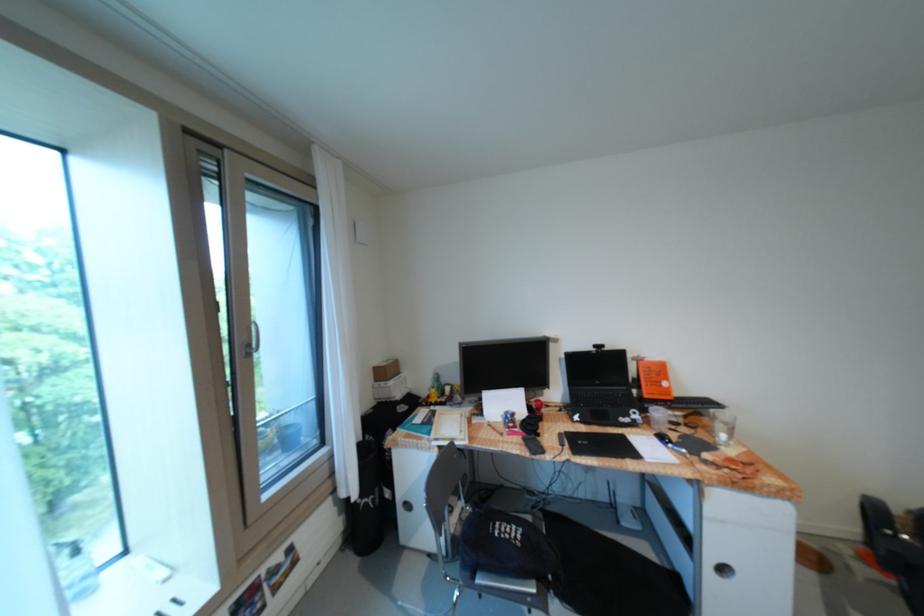
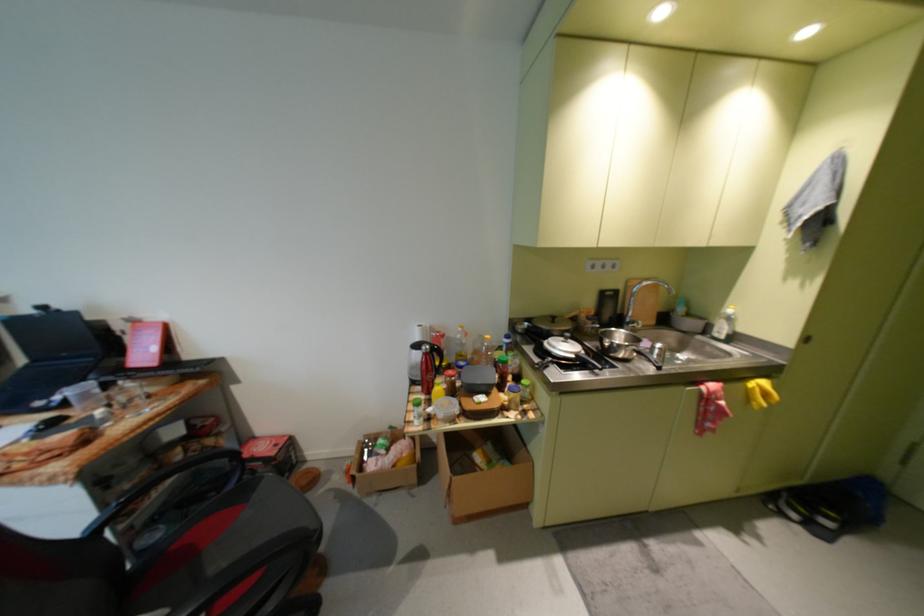
Question: Which direction would the cameraman need to move to produce the second image? Reply with the corresponding letter.

Choices:
 (A) Left
 (B) Right
 (C) Forward
 (D) Backward

Answer: (B)